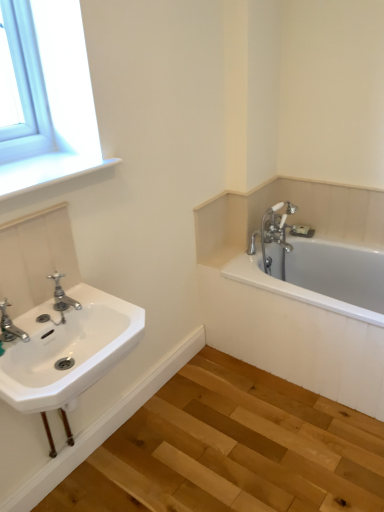
Where is `free point below white porcelain sink at left (from a real-world perspective)`? This screenshot has width=384, height=512. free point below white porcelain sink at left (from a real-world perspective) is located at coordinates (104, 481).